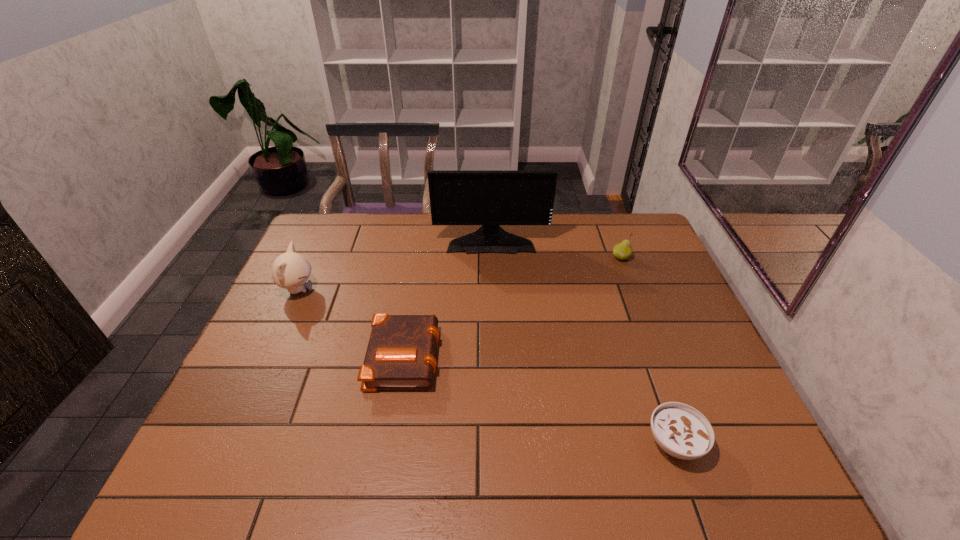
The image size is (960, 540). I want to click on unoccupied position between the monitor and the third nearest object, so click(x=395, y=265).

Find the location of `free spot between the tallest object and the nearest object`. free spot between the tallest object and the nearest object is located at coordinates (583, 341).

Locate an element on the screen. free space between the leftmost object and the third tallest object is located at coordinates (460, 274).

Identify the location of vacant area between the fourth shortest object and the soup bowl. (487, 366).

Locate which object is the third closest to the leftmost object. Please provide its 2D coordinates. Your answer should be formatted as a tuple, i.e. [(x, y)], where the tuple contains the x and y coordinates of a point satisfying the conditions above.

[(623, 250)]

Identify which object is the third nearest to the monitor. Please provide its 2D coordinates. Your answer should be formatted as a tuple, i.e. [(x, y)], where the tuple contains the x and y coordinates of a point satisfying the conditions above.

[(290, 270)]

Image resolution: width=960 pixels, height=540 pixels. I want to click on blank space that satisfies the following two spatial constraints: 1. on the screen side of the nearest object; 2. on the left side of the monitor, so tap(497, 442).

Where is `free spot that satisfies the following two spatial constraints: 1. on the screen side of the pear; 2. on the right side of the tallest object`? free spot that satisfies the following two spatial constraints: 1. on the screen side of the pear; 2. on the right side of the tallest object is located at coordinates (492, 258).

I want to click on free space that satisfies the following two spatial constraints: 1. on the spine side of the nearest object; 2. on the left side of the Bible, so click(390, 442).

At what (x,y) coordinates should I click in order to perform the action: click on free space that satisfies the following two spatial constraints: 1. on the screen side of the soup bowl; 2. on the left side of the monitor. Please return your answer as a coordinate pair (x, y). Looking at the image, I should click on (497, 442).